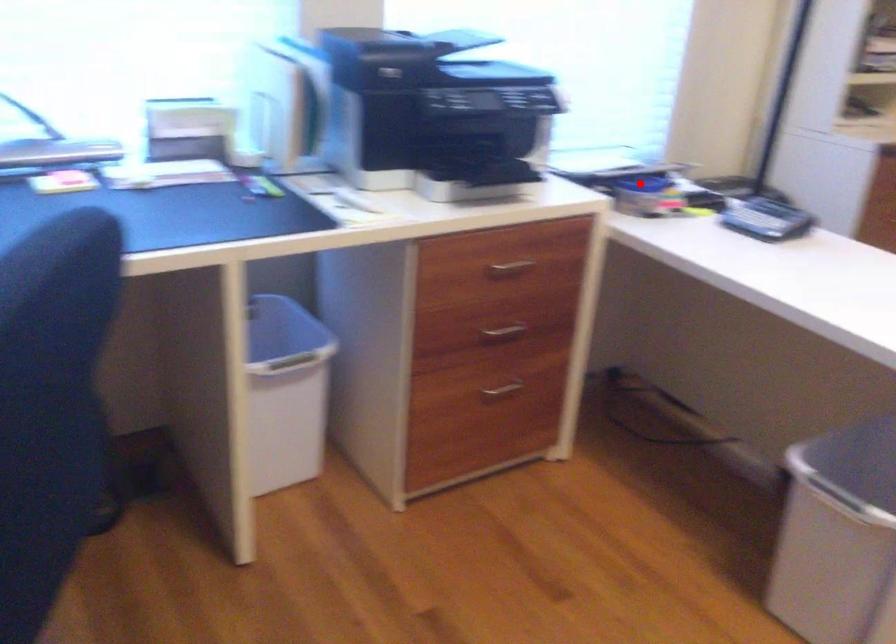
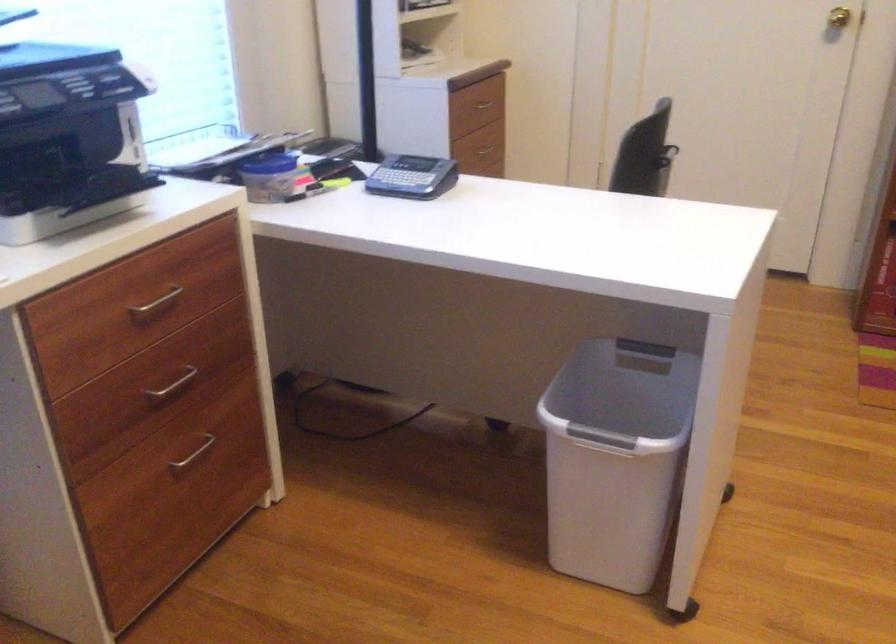
Where in the second image is the point corresponding to the highlighted location from the first image?

(270, 164)